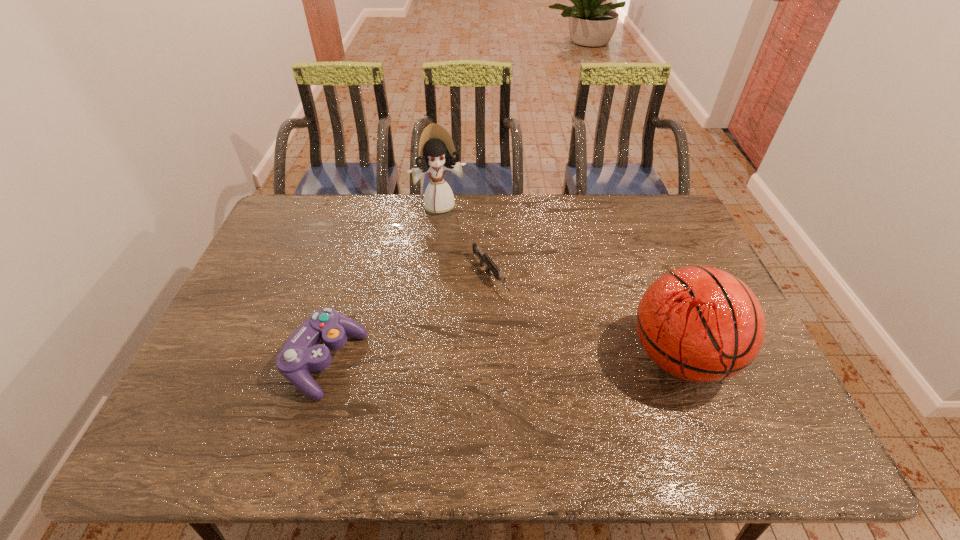
I want to click on unoccupied position between the basketball and the third nearest object, so click(x=585, y=317).

Locate an element on the screen. vacant area between the control and the doll is located at coordinates (383, 284).

You are a GUI agent. You are given a task and a screenshot of the screen. Output one action in this format:
    pyautogui.click(x=<x>, y=<y>)
    Task: Click on the vacant area that lies between the second shortest object and the rightmost object
    The width and height of the screenshot is (960, 540).
    Given the screenshot: What is the action you would take?
    pyautogui.click(x=502, y=360)

The image size is (960, 540). In order to click on vacant region between the third object from right to left and the shortest object in this screenshot , I will do (466, 241).

Find the location of a particular element. free spot between the leftmost object and the basketball is located at coordinates (502, 360).

This screenshot has height=540, width=960. What are the coordinates of `object that stands as the third closest to the rightmost object` in the screenshot? It's located at (304, 351).

Locate an element on the screen. The height and width of the screenshot is (540, 960). object that is the second nearest to the third tallest object is located at coordinates 437,153.